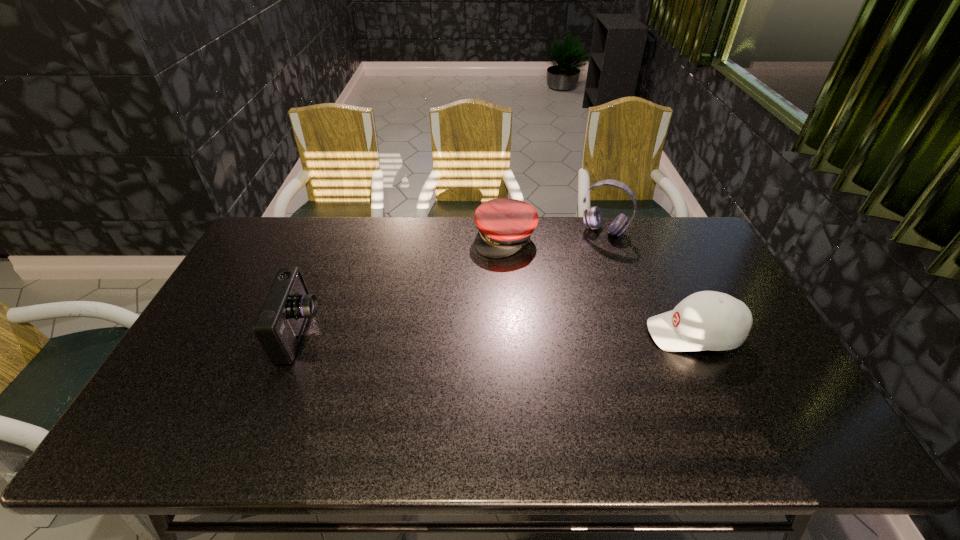
This screenshot has width=960, height=540. Find the location of `camera`. camera is located at coordinates (279, 326).

Where is `the third shortest object`? The width and height of the screenshot is (960, 540). the third shortest object is located at coordinates (279, 326).

Locate an element on the screen. baseball cap is located at coordinates (708, 320).

Find the location of a particular element. the second object from left to right is located at coordinates (505, 225).

Locate an element on the screen. The height and width of the screenshot is (540, 960). the shortest object is located at coordinates (505, 225).

Locate an element on the screen. headset is located at coordinates (592, 218).

Find the location of a particular element. Image resolution: width=960 pixels, height=540 pixels. free space located 0.400m on the front-facing side of the camera is located at coordinates (461, 333).

Image resolution: width=960 pixels, height=540 pixels. In order to click on free space located 0.090m on the front-facing side of the third tallest object in this screenshot , I will do `click(615, 334)`.

At what (x,y) coordinates should I click in order to perform the action: click on vacant space situated 0.080m on the front-facing side of the third tallest object. Please return your answer as a coordinate pair (x, y). Looking at the image, I should click on (619, 334).

Image resolution: width=960 pixels, height=540 pixels. In order to click on free space located on the front-facing side of the third tallest object in this screenshot , I will do `click(565, 334)`.